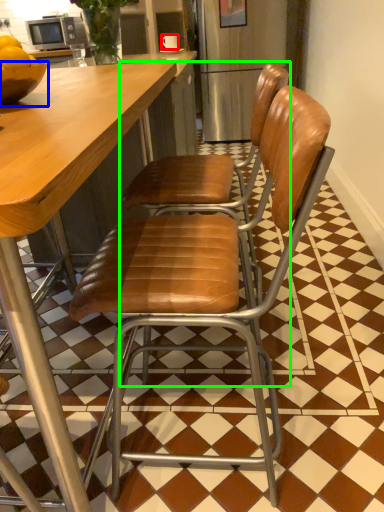
Question: Considering the real-world distances, which object is farthest from coffee cup (highlighted by a red box)? bowl (highlighted by a blue box) or chair (highlighted by a green box)?

Choices:
 (A) bowl
 (B) chair

Answer: (A)